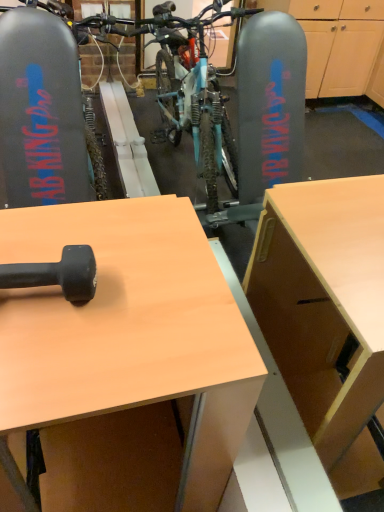
Question: Would you say black rubber dumbbell at upper left is inside or outside light brown wood desk at center?

Choices:
 (A) outside
 (B) inside

Answer: (A)

Question: From a real-world perspective, is black rubber dumbbell at upper left positioned above or below light brown wood desk at center?

Choices:
 (A) below
 (B) above

Answer: (B)

Question: In the image, is black rubber dumbbell at upper left positioned in front of or behind light brown wood desk at center?

Choices:
 (A) behind
 (B) front

Answer: (A)

Question: Relative to black rubber dumbbell at upper left, is light brown wood desk at center in front or behind?

Choices:
 (A) behind
 (B) front

Answer: (B)

Question: From a real-world perspective, is light brown wood desk at center above or below black rubber dumbbell at upper left?

Choices:
 (A) below
 (B) above

Answer: (A)

Question: Considering the positions of light brown wood desk at center and black rubber dumbbell at upper left in the image, is light brown wood desk at center wider or thinner than black rubber dumbbell at upper left?

Choices:
 (A) wide
 (B) thin

Answer: (A)

Question: Considering the positions of light brown wood desk at center and black rubber dumbbell at upper left in the image, is light brown wood desk at center bigger or smaller than black rubber dumbbell at upper left?

Choices:
 (A) small
 (B) big

Answer: (B)